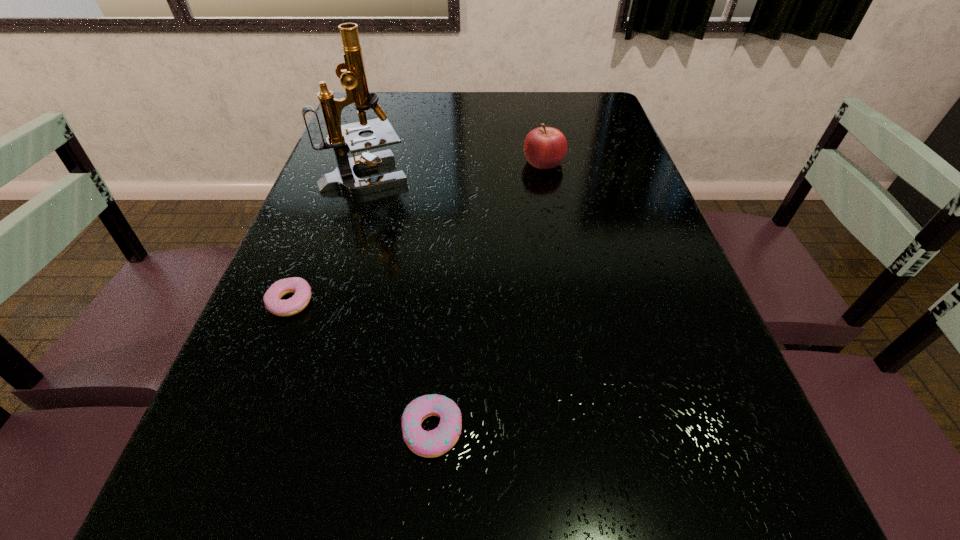
Identify the location of empty space between the third object from left to right and the farther doughnut. (361, 366).

Where is `vacant area between the nearer doughnut and the second tallest object`? This screenshot has width=960, height=540. vacant area between the nearer doughnut and the second tallest object is located at coordinates (488, 295).

Identify the location of vacant point located between the farther doughnut and the third shortest object. Image resolution: width=960 pixels, height=540 pixels. click(x=418, y=232).

Identify the location of empty location between the second nearest object and the third shortest object. This screenshot has height=540, width=960. (418, 232).

You are a GUI agent. You are given a task and a screenshot of the screen. Output one action in this format:
    pyautogui.click(x=<x>, y=<y>)
    Task: Click on the free space between the tallest object and the farther doughnut
    
    Given the screenshot: What is the action you would take?
    pyautogui.click(x=328, y=238)

Identify the location of empty space between the rightmost object and the tallest object. (455, 168).

Identify the location of vacant area between the tallest object and the second tallest object. (455, 168).

The image size is (960, 540). I want to click on unoccupied position between the rightmost object and the right doughnut, so click(x=488, y=295).

I want to click on object that is the second closest to the left doughnut, so click(342, 138).

Where is `the third closest object to the third shortest object`? The height and width of the screenshot is (540, 960). the third closest object to the third shortest object is located at coordinates (434, 443).